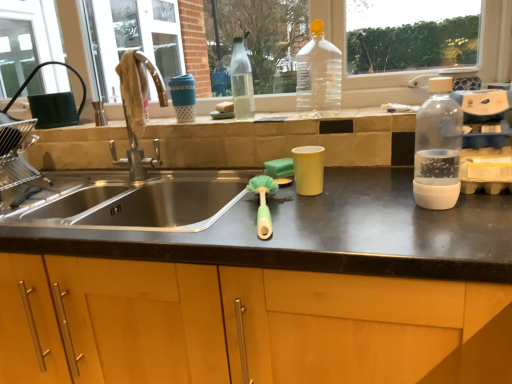
Find the location of `vacant region to the right of green rubber brush at center`. vacant region to the right of green rubber brush at center is located at coordinates (333, 213).